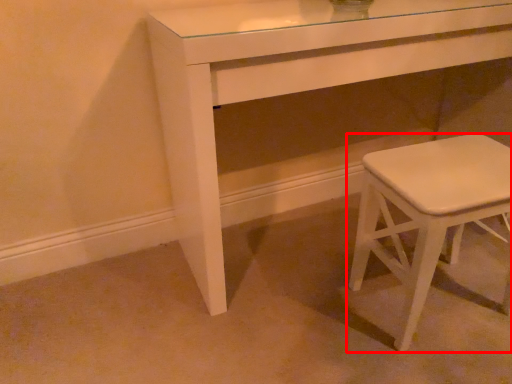
Question: From the image's perspective, where is stool (annotated by the red box) located in relation to table in the image?

Choices:
 (A) above
 (B) below

Answer: (B)